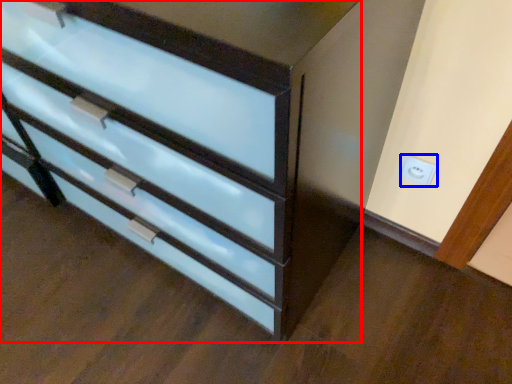
Question: Which point is further to the camera, chest of drawers (highlighted by a red box) or electric outlet (highlighted by a blue box)?

Choices:
 (A) chest of drawers
 (B) electric outlet

Answer: (B)